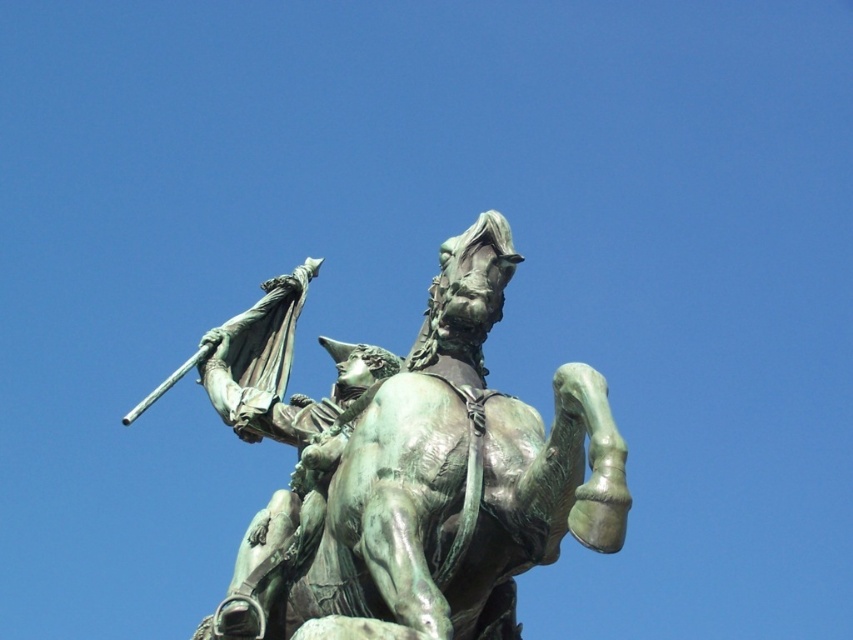
Who is taller, green patina bronze horse and rider at center or green patina statue at upper center?

With more height is green patina bronze horse and rider at center.

Which is below, green patina bronze horse and rider at center or green patina statue at upper center?

green patina statue at upper center is lower down.

What do you see at coordinates (410, 468) in the screenshot? I see `green patina bronze horse and rider at center` at bounding box center [410, 468].

The width and height of the screenshot is (853, 640). What are the coordinates of `green patina bronze horse and rider at center` in the screenshot? It's located at (410, 468).